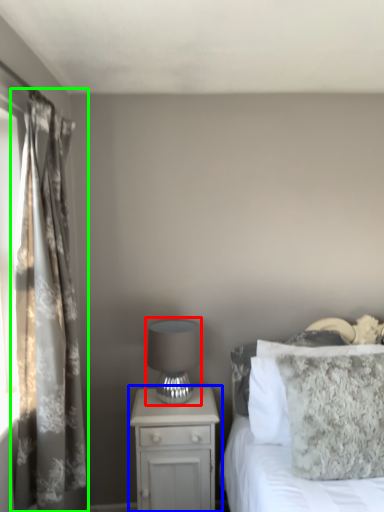
Question: Estimate the real-world distances between objects in this image. Which object is closer to table lamp (highlighted by a red box), nightstand (highlighted by a blue box) or curtain (highlighted by a green box)?

Choices:
 (A) nightstand
 (B) curtain

Answer: (A)